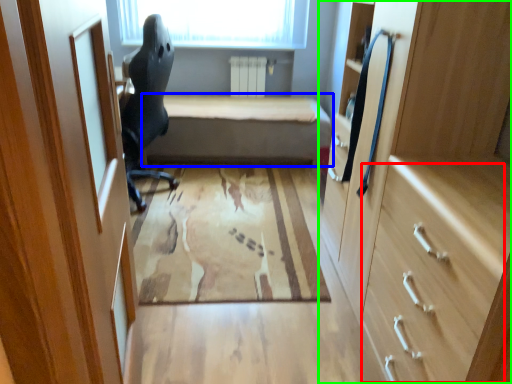
Question: Which object is the closest to the drawer (highlighted by a red box)? Choose among these: furniture (highlighted by a blue box) or cabinetry (highlighted by a green box).

Choices:
 (A) furniture
 (B) cabinetry

Answer: (B)